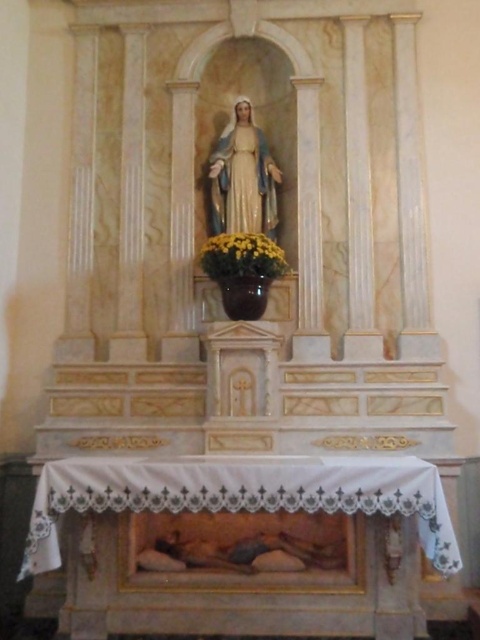
Is yellow matte vase at center further to camera compared to glossy ceramic vase at center?

No, yellow matte vase at center is closer to the viewer.

Can you confirm if yellow matte vase at center is wider than glossy ceramic vase at center?

Correct, the width of yellow matte vase at center exceeds that of glossy ceramic vase at center.

Which is behind, point (251, 234) or point (257, 291)?

The point (257, 291) is more distant.

The image size is (480, 640). In order to click on yellow matte vase at center in this screenshot , I will do `click(241, 257)`.